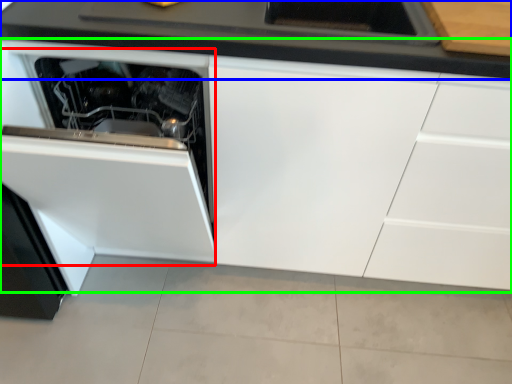
Question: Which is nearer to the oven (highlighted by a red box)? countertop (highlighted by a blue box) or cabinetry (highlighted by a green box).

Choices:
 (A) countertop
 (B) cabinetry

Answer: (B)